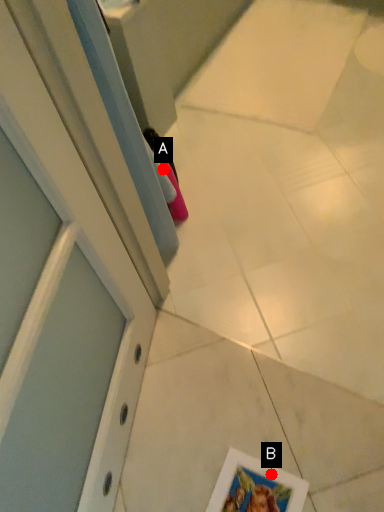
Question: Two points are circled on the image, labeled by A and B beside each circle. Which point is further to the camera?

Choices:
 (A) A is further
 (B) B is further

Answer: (A)